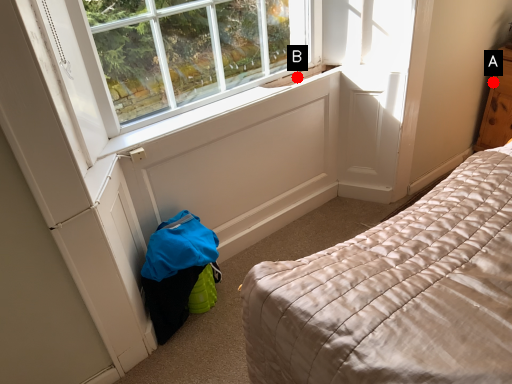
Question: Two points are circled on the image, labeled by A and B beside each circle. Which point is closer to the camera?

Choices:
 (A) A is closer
 (B) B is closer

Answer: (B)